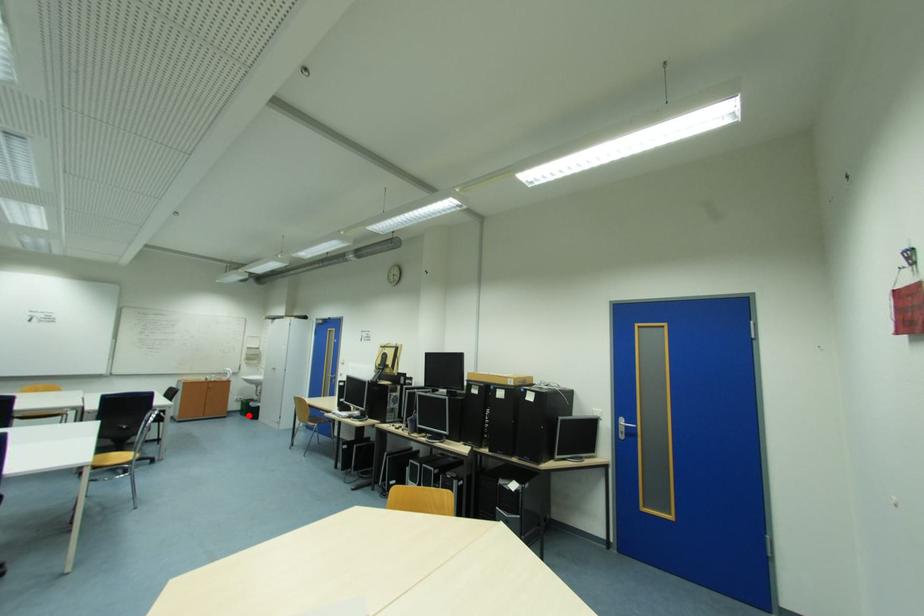
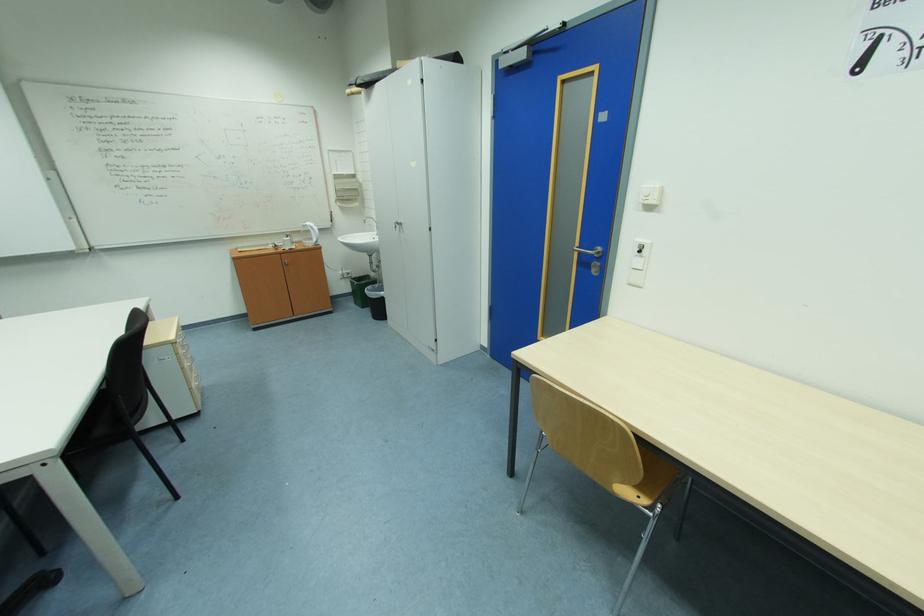
Locate, in the second image, the point that corresponds to the highlighted location in the first image.

(362, 304)